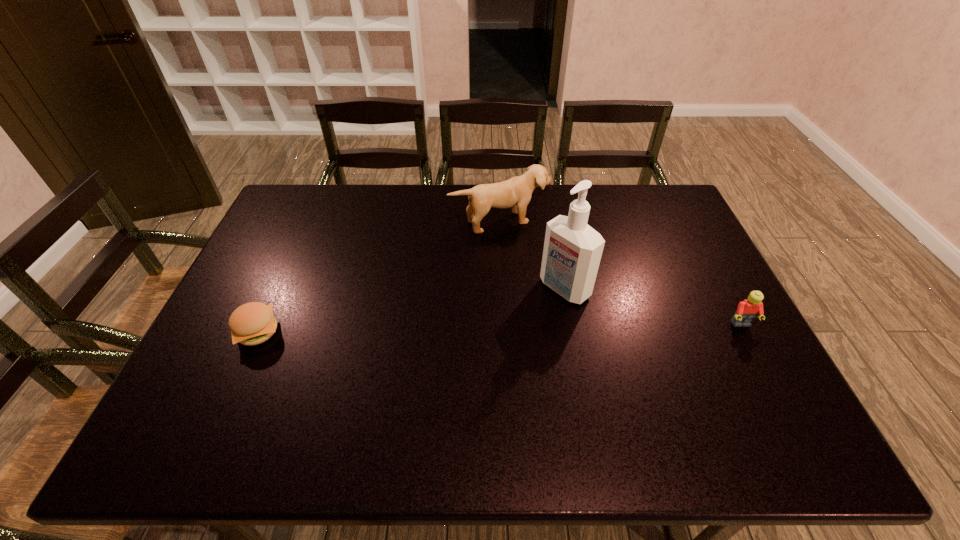
Find the location of `vacant position at the near edge of the desktop`. vacant position at the near edge of the desktop is located at coordinates (630, 407).

Find the location of `vacant region at the left edge of the desktop`. vacant region at the left edge of the desktop is located at coordinates (280, 289).

At what (x,y) coordinates should I click in order to perform the action: click on vacant region at the right edge. Please return your answer as a coordinate pair (x, y). Image resolution: width=960 pixels, height=540 pixels. Looking at the image, I should click on (680, 238).

At what (x,y) coordinates should I click in order to perform the action: click on vacant space at the far left corner of the desktop. Please return your answer as a coordinate pair (x, y). Looking at the image, I should click on (308, 200).

Identify the location of empty space that is in between the tallest object and the Lego. (653, 307).

You are a GUI agent. You are given a task and a screenshot of the screen. Output one action in this format:
    pyautogui.click(x=<x>, y=<y>)
    Task: Click on the free space that is in between the leftmost object and the tallest object
    The width and height of the screenshot is (960, 540).
    Given the screenshot: What is the action you would take?
    pyautogui.click(x=411, y=310)

Where is `vacant space that's between the third tallest object and the third shortest object`? This screenshot has width=960, height=540. vacant space that's between the third tallest object and the third shortest object is located at coordinates (621, 273).

This screenshot has width=960, height=540. Find the location of `empty space between the shortest object and the Lego`. empty space between the shortest object and the Lego is located at coordinates (499, 328).

Locate an element on the screen. free spot between the third nearest object and the rightmost object is located at coordinates (653, 307).

This screenshot has width=960, height=540. What are the coordinates of `vacant space in between the third nearest object and the farthest object` in the screenshot? It's located at (533, 254).